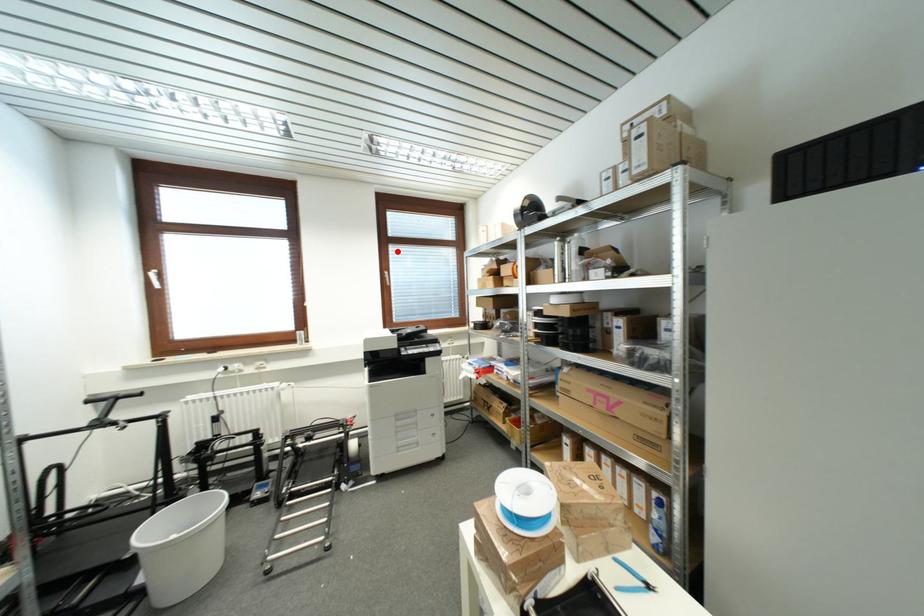
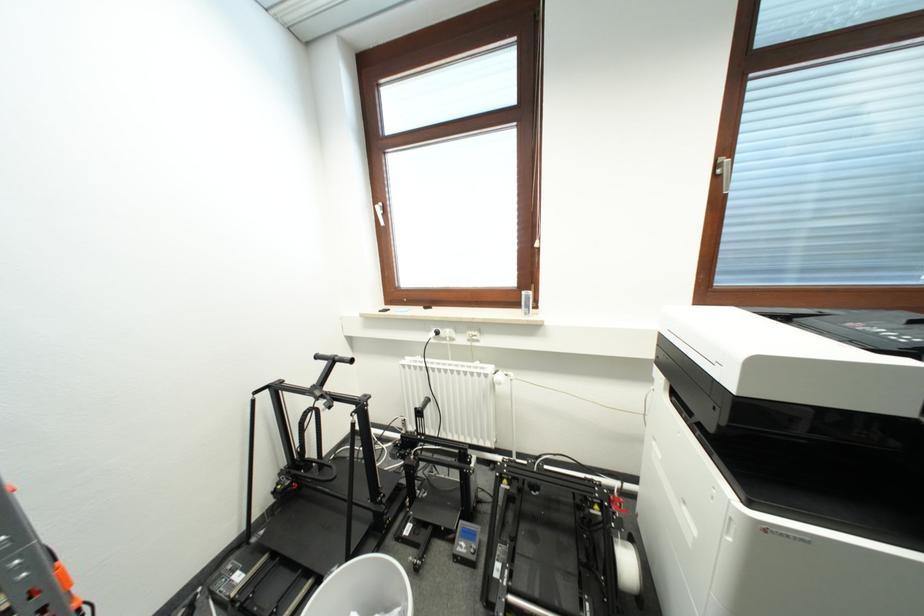
The point at the highlighted location is marked in the first image. Where is the corresponding point in the second image?

(766, 89)